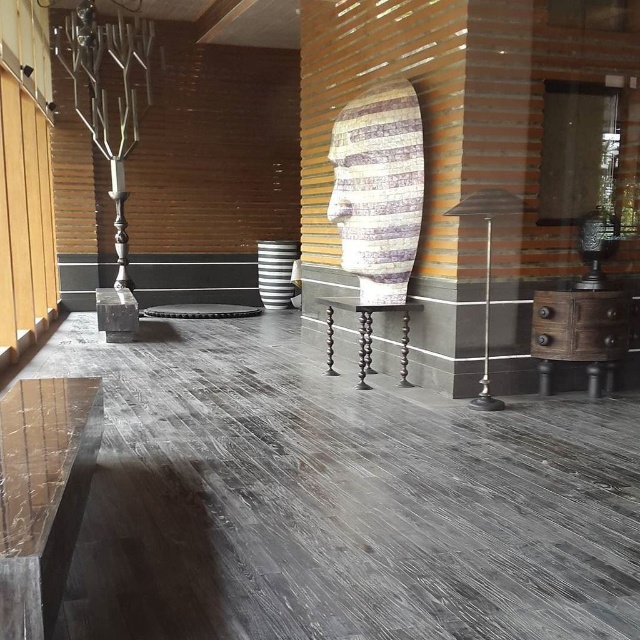
Question: Which point is closer to the camera?

Choices:
 (A) silver polished pillar at left
 (B) polished dark wood stool at center
 (C) bronze textured candle holder at right

Answer: (C)

Question: Which point is closer to the camera taking this photo?

Choices:
 (A) (109, 161)
 (B) (580, 225)
 (C) (500, 204)

Answer: (C)

Question: Is polished brass candle holder at center thinner than matte striped vase at center?

Choices:
 (A) no
 (B) yes

Answer: (B)

Question: Does polished brass candle holder at center have a larger size compared to matte striped vase at center?

Choices:
 (A) yes
 (B) no

Answer: (B)

Question: Does polished dark wood stool at center appear on the right side of bronze textured candle holder at right?

Choices:
 (A) yes
 (B) no

Answer: (B)

Question: Estimate the real-world distances between objects in this image. Which object is farther from the polished brass candle holder at center?

Choices:
 (A) bronze textured candle holder at right
 (B) silver polished pillar at left
 (C) polished dark wood stool at center
 (D) matte striped vase at center

Answer: (D)